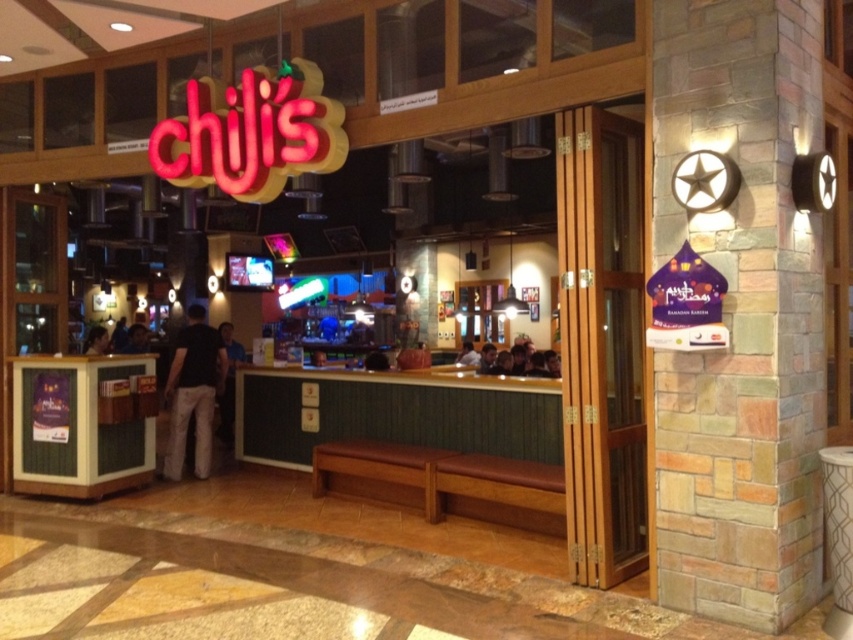
Does point (618, 576) come in front of point (102, 340)?

That is True.

You are a GUI agent. You are given a task and a screenshot of the screen. Output one action in this format:
    pyautogui.click(x=<x>, y=<y>)
    Task: Click on the wooden door at center
    The width and height of the screenshot is (853, 640).
    Given the screenshot: What is the action you would take?
    pyautogui.click(x=602, y=342)

I want to click on wooden door at center, so pyautogui.click(x=602, y=342).

You are a GUI agent. You are given a task and a screenshot of the screen. Output one action in this format:
    pyautogui.click(x=<x>, y=<y>)
    Task: Click on the wooden door at center
    This screenshot has height=640, width=853.
    Given the screenshot: What is the action you would take?
    pyautogui.click(x=602, y=342)

Is black cotton pants at center taller than black shirt at left?

Correct, black cotton pants at center is much taller as black shirt at left.

Who is more forward, (161, 468) or (103, 332)?

Point (161, 468) is in front.

Locate an element on the screen. black cotton pants at center is located at coordinates (193, 392).

Does point (619, 150) come behind point (177, 390)?

No, (619, 150) is closer to viewer.

Is wooden door at center above black cotton pants at center?

Correct, wooden door at center is located above black cotton pants at center.

Does point (595, 332) come behind point (209, 403)?

No, (595, 332) is in front of (209, 403).

The height and width of the screenshot is (640, 853). I want to click on wooden door at center, so click(x=602, y=342).